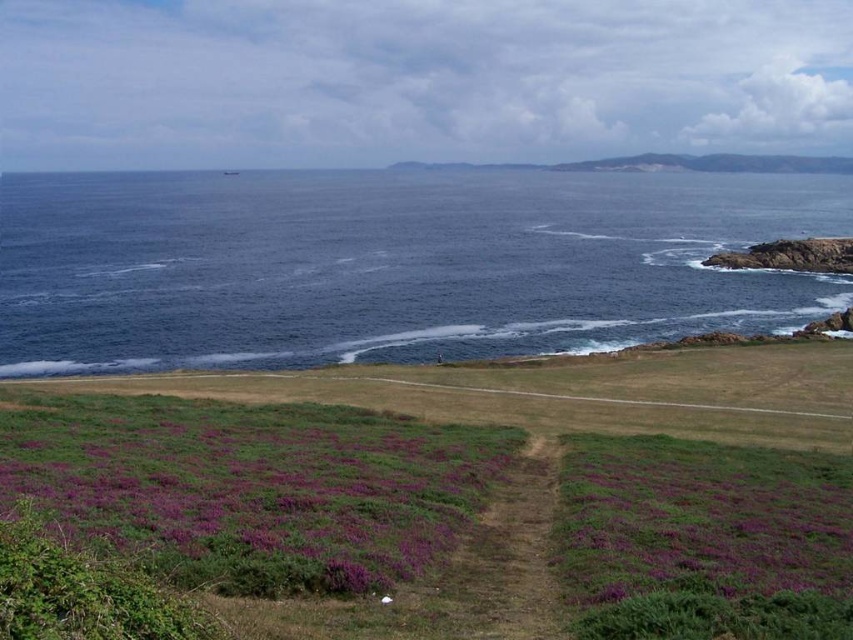
Question: Which point is farther from the camera taking this photo?

Choices:
 (A) (613, 538)
 (B) (193, 467)
 (C) (456, 186)
 (D) (350, 438)

Answer: (C)

Question: Is purple grassy at lower center further to camera compared to purple soft grass at lower center?

Choices:
 (A) no
 (B) yes

Answer: (A)

Question: Among these objects, which one is nearest to the camera?

Choices:
 (A) purple soft grass at lower left
 (B) deep blue water at lower left
 (C) purple grassy at lower center

Answer: (C)

Question: Does purple grassy at lower center appear over deep blue water at lower left?

Choices:
 (A) no
 (B) yes

Answer: (A)

Question: Based on their relative distances, which object is farther from the purple soft grass at lower left?

Choices:
 (A) purple grassy at lower center
 (B) purple soft grass at lower center

Answer: (B)

Question: Is purple grassy at lower center further to camera compared to purple soft grass at lower center?

Choices:
 (A) yes
 (B) no

Answer: (B)